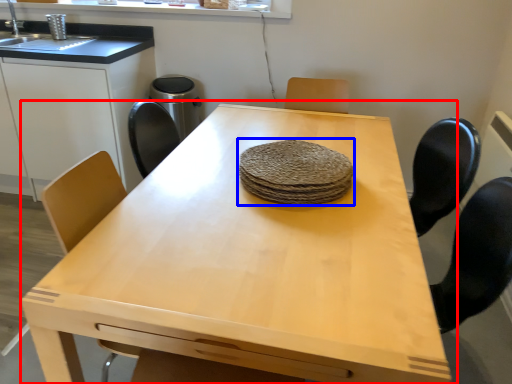
Question: Which of the following is the farthest to the observer, table (highlighted by a red box) or food (highlighted by a blue box)?

Choices:
 (A) table
 (B) food

Answer: (B)